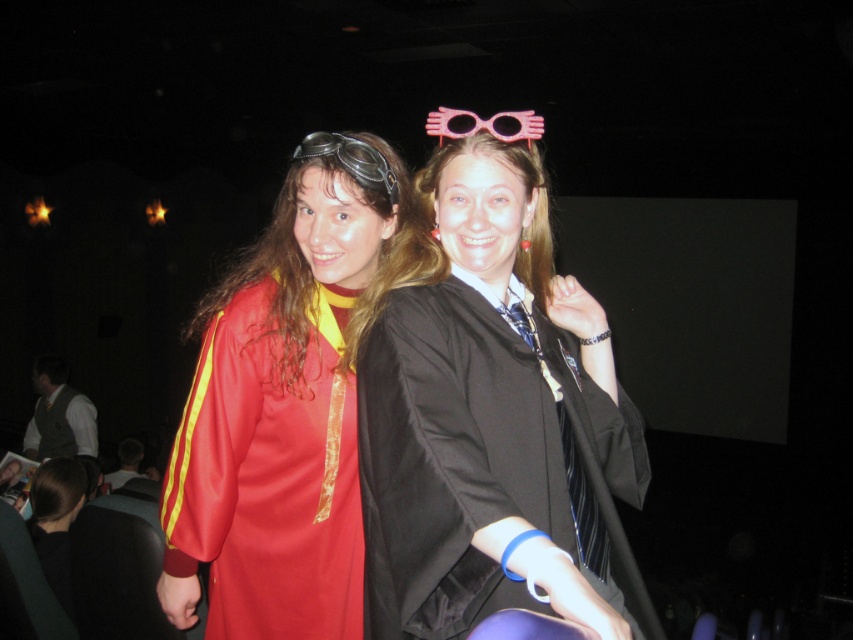
Which is below, matte black graduation gown at center or matte gray vest at lower left?

Positioned lower is matte gray vest at lower left.

Does matte black graduation gown at center appear on the right side of matte gray vest at lower left?

Yes, matte black graduation gown at center is to the right of matte gray vest at lower left.

Is point (560, 593) positioned behind point (41, 365)?

No, it is in front of (41, 365).

Locate an element on the screen. The image size is (853, 640). matte black graduation gown at center is located at coordinates (492, 420).

Is matte red gown at center to the left of dark brown leather jacket at lower left from the viewer's perspective?

No, matte red gown at center is not to the left of dark brown leather jacket at lower left.

Does point (364, 236) lie in front of point (107, 476)?

Yes.

Image resolution: width=853 pixels, height=640 pixels. In order to click on matte red gown at center in this screenshot , I will do `click(288, 401)`.

Is matte black graduation gown at center further to camera compared to matte red gown at center?

No, matte black graduation gown at center is closer to the viewer.

Does matte black graduation gown at center have a greater height compared to matte red gown at center?

Incorrect, matte black graduation gown at center's height is not larger of matte red gown at center's.

At what (x,y) coordinates should I click in order to perform the action: click on matte black graduation gown at center. Please return your answer as a coordinate pair (x, y). Looking at the image, I should click on (492, 420).